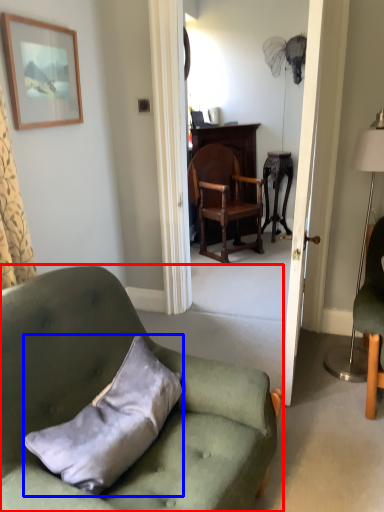
Question: Which of the following is the farthest to the observer, chair (highlighted by a red box) or pillow (highlighted by a blue box)?

Choices:
 (A) chair
 (B) pillow

Answer: (B)